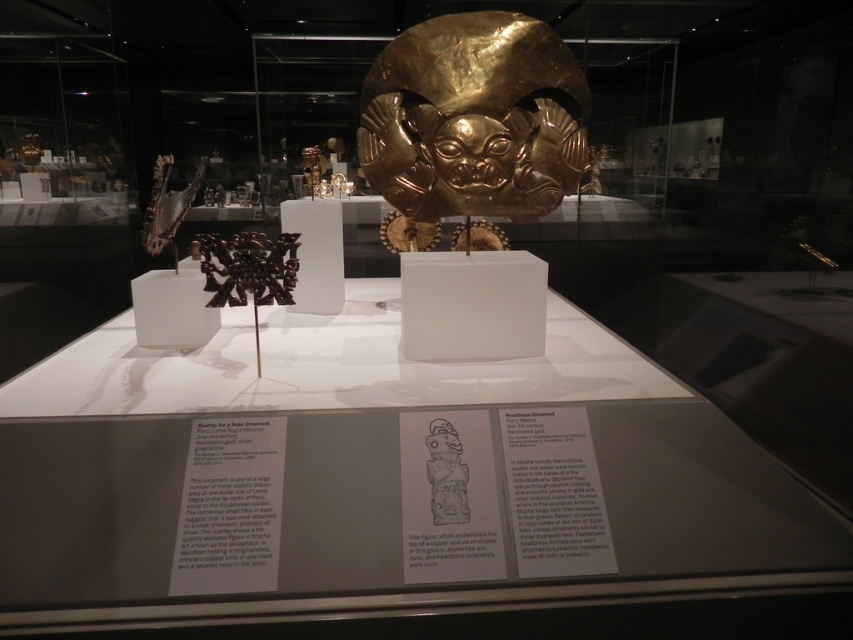
At what (x,y) coordinates should I click in order to perform the action: click on gold shiny mask at center. Please return your answer as a coordinate pair (x, y). This screenshot has height=640, width=853. Looking at the image, I should click on (473, 122).

Does gold shiny mask at center appear on the left side of matte gold mask at center?

No, gold shiny mask at center is not to the left of matte gold mask at center.

Between point (483, 128) and point (457, 449), which one is positioned behind?

The point (483, 128) is behind.

Find the location of a particular element. gold shiny mask at center is located at coordinates (473, 122).